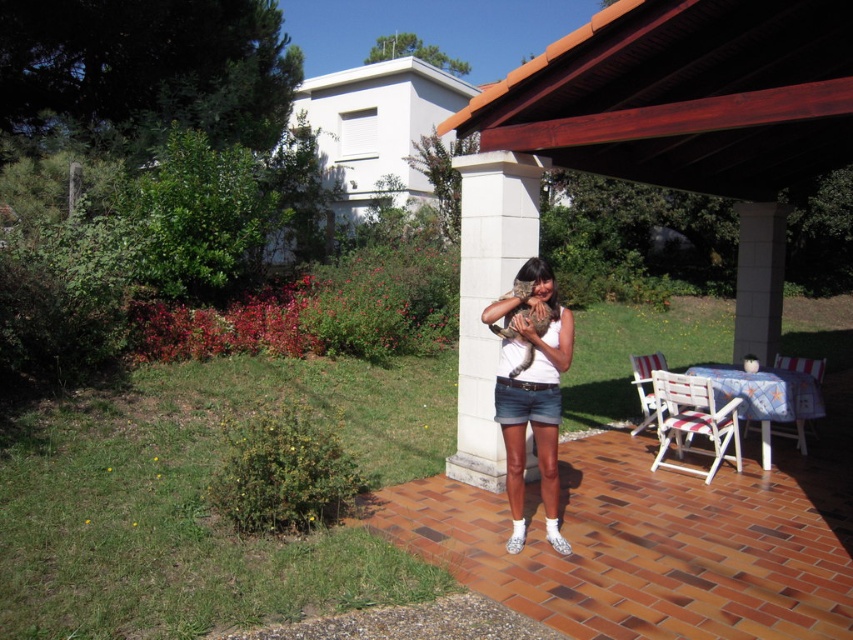
From the picture: You are a drone operator trying to capture a photo of the woman holding the cat. The drone is currently at the position of the brown wood canopy at upper center. To get a clear shot, you need to move the drone to the left by 0.1 units. What will be the new coordinates of the drone?

The brown wood canopy at upper center is at point (683, 96). Moving left by 0.1 units would subtract 0.1 from the x coordinate, resulting in new coordinates of (683, 32).

You are planning to place a small potted plant between the brown wood canopy at upper center and the plaid fabric chair at lower right. Based on their positions, which object should the plant be closer to?

The brown wood canopy at upper center is positioned on the left side of plaid fabric chair at lower right, so the plant should be placed closer to the brown wood canopy at upper center to maintain symmetry between the two objects.

You are planning to place a new potted plant between the brown wood canopy at upper center and the white striped wood chair at lower right. Based on their positions, which object should the plant be closer to?

The brown wood canopy at upper center is positioned on the left side of white striped wood chair at lower right. Therefore, the potted plant should be placed closer to the brown wood canopy at upper center since it is the leftmost object in this arrangement.